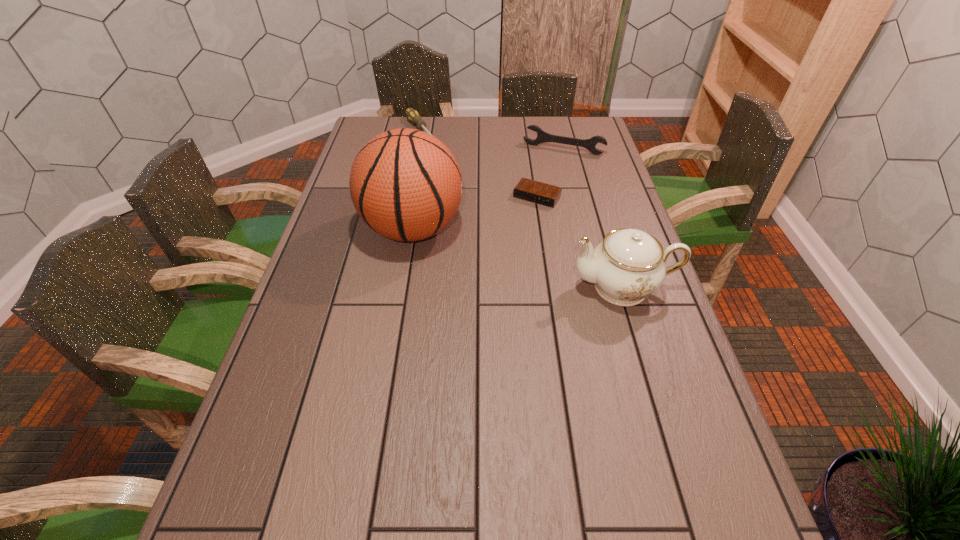
At what (x,y) coordinates should I click in order to perform the action: click on vacant space on the desktop that is between the basketball and the fourth shortest object and is positioned at the tip of the fourth tallest object. Please return your answer as a coordinate pair (x, y). Looking at the image, I should click on (538, 264).

At what (x,y) coordinates should I click in order to perform the action: click on free space on the desktop that is between the tallest object and the chinaware and is positioned on the open ends of the wrench. Please return your answer as a coordinate pair (x, y). Looking at the image, I should click on (523, 260).

I want to click on free space on the desktop that is between the tallest object and the fourth shortest object and is positioned on the front face of the alarm clock, so click(x=500, y=253).